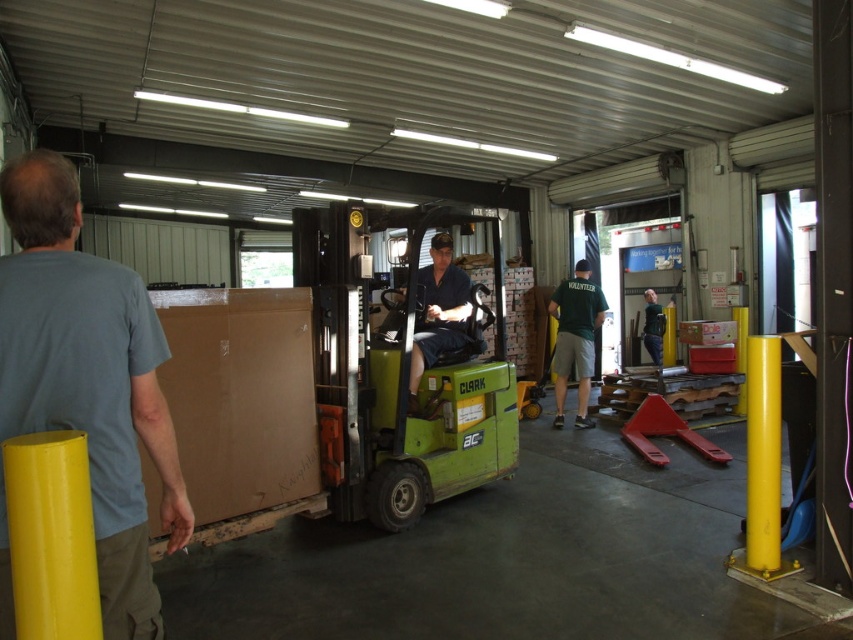
Question: Can you confirm if gray cotton shirt at left is thinner than green fabric shirt at center?

Choices:
 (A) no
 (B) yes

Answer: (B)

Question: Estimate the real-world distances between objects in this image. Which object is closer to the matte black shirt at center?

Choices:
 (A) green fabric shirt at center
 (B) green cotton shirt at center

Answer: (B)

Question: Which point is closer to the camera taking this photo?

Choices:
 (A) (112, 467)
 (B) (450, 252)
 (C) (560, 371)

Answer: (A)

Question: Does gray cotton shirt at left appear on the right side of green cotton shirt at center?

Choices:
 (A) yes
 (B) no

Answer: (B)

Question: Estimate the real-world distances between objects in this image. Which object is farther from the matte black shirt at center?

Choices:
 (A) green cotton shirt at center
 (B) gray cotton shirt at left
 (C) green fabric shirt at center

Answer: (C)

Question: Is gray cotton shirt at left further to the viewer compared to matte black shirt at center?

Choices:
 (A) no
 (B) yes

Answer: (A)